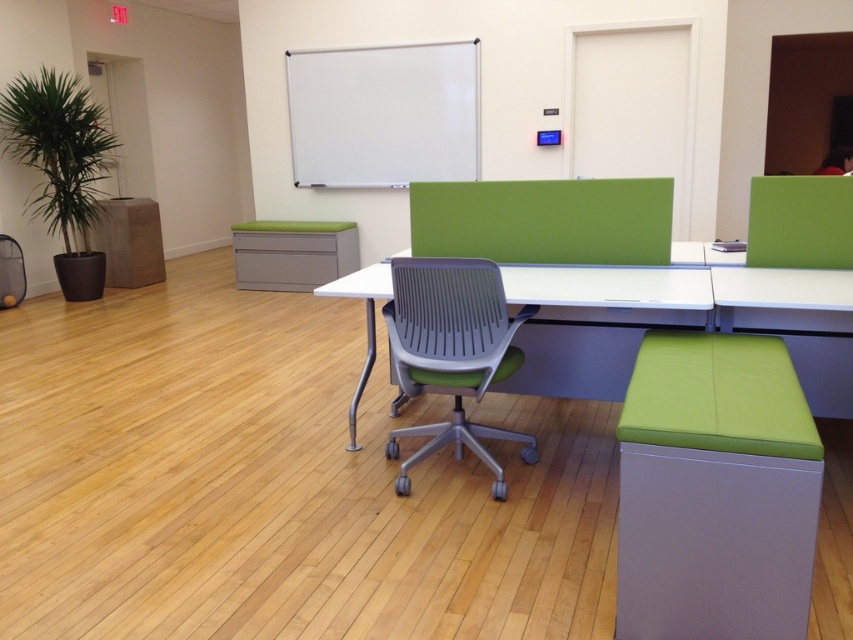
Question: Which of the following is the closest to the observer?

Choices:
 (A) (393, 324)
 (B) (666, 268)

Answer: (A)

Question: Is green fabric stool at lower right further to camera compared to white plastic table at center?

Choices:
 (A) yes
 (B) no

Answer: (B)

Question: Considering the relative positions of green fabric stool at lower right and white plastic table at center in the image provided, where is green fabric stool at lower right located with respect to white plastic table at center?

Choices:
 (A) above
 (B) below

Answer: (B)

Question: Which object appears closest to the camera in this image?

Choices:
 (A) gray plastic swivel chair at center
 (B) green fabric stool at lower right

Answer: (B)

Question: Based on their relative distances, which object is farther from the white plastic table at center?

Choices:
 (A) green fabric stool at lower right
 (B) gray plastic swivel chair at center

Answer: (A)

Question: Can you confirm if green fabric stool at lower right is positioned to the right of gray plastic swivel chair at center?

Choices:
 (A) no
 (B) yes

Answer: (B)